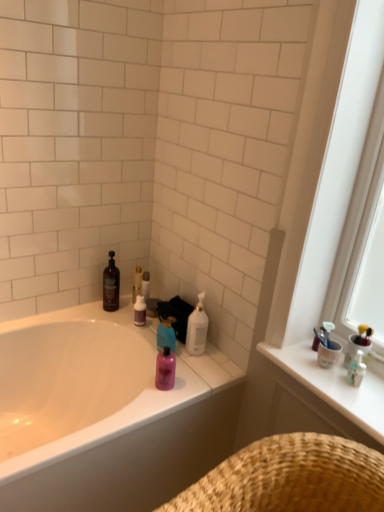
What are the coordinates of `free location to the right of white glossy bottle at upper center, which appears as the third cleaning product when viewed from the left` in the screenshot? It's located at (220, 360).